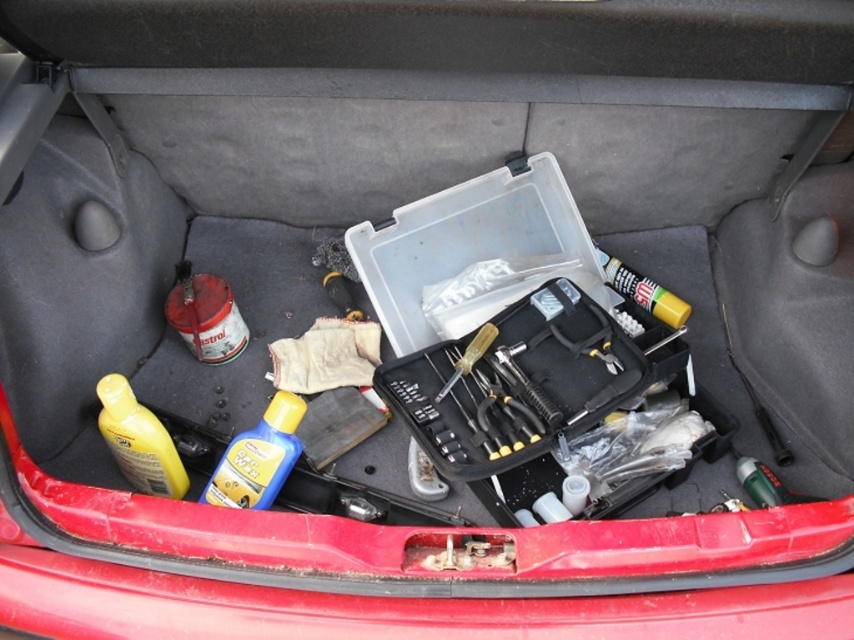
Question: Which of the following is the farthest from the observer?

Choices:
 (A) (638, 289)
 (B) (468, 349)
 (C) (220, 472)

Answer: (A)

Question: Is yellow glossy bottle at lower left above yellow matte bottle at lower left?

Choices:
 (A) no
 (B) yes

Answer: (B)

Question: Does yellow matte bottle at lower left appear on the right side of metallic screwdriver at center?

Choices:
 (A) yes
 (B) no

Answer: (B)

Question: Which point is farther to the camera?

Choices:
 (A) (124, 433)
 (B) (276, 470)

Answer: (B)

Question: Among these objects, which one is farthest from the camera?

Choices:
 (A) metallic screwdriver at center
 (B) yellow glossy bottle at lower left
 (C) yellow matte glue stick at center
 (D) yellow matte bottle at lower left

Answer: (C)

Question: Is yellow matte glue stick at center below metallic screwdriver at center?

Choices:
 (A) yes
 (B) no

Answer: (B)